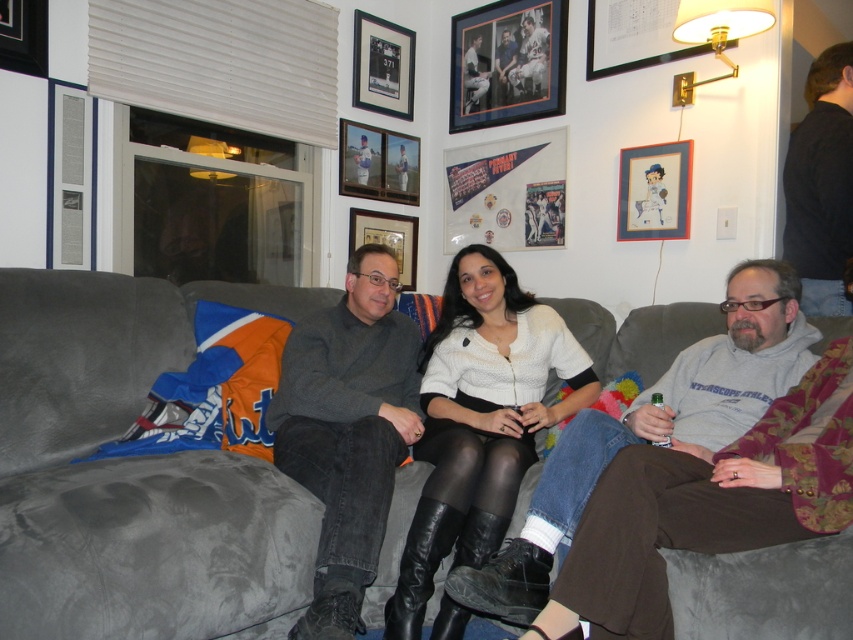
You are organizing a small party and need to place a decorative item on the couch. The white matte sweater at center and the brushed metal picture frame at upper left are available. If you want to choose the bigger item for visibility, which one should you pick?

The white matte sweater at center is larger in size than the brushed metal picture frame at upper left, so you should choose the white matte sweater at center for better visibility.

You are a tailor who needs to determine if the gray velvety pants at center can be placed inside the wooden picture frame at center without folding. Can you confirm based on their sizes?

The gray velvety pants at center might be wider than wooden picture frame at center, so there is a possibility they won not fit inside without folding.